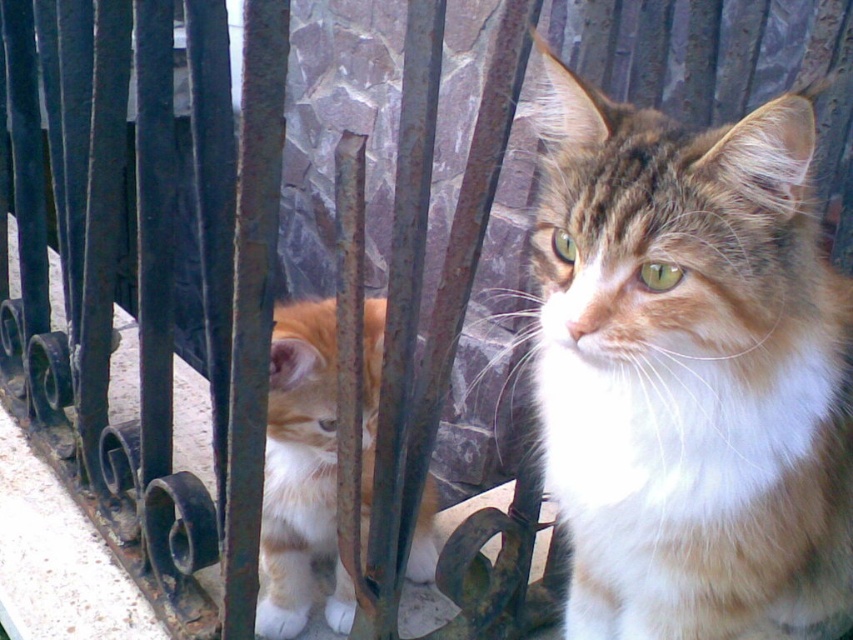
Who is positioned more to the left, fluffy orange-white cat at center or orange tabby fur at left?

orange tabby fur at left is more to the left.

The image size is (853, 640). What do you see at coordinates (689, 371) in the screenshot? I see `fluffy orange-white cat at center` at bounding box center [689, 371].

Where is `fluffy orange-white cat at center`? The height and width of the screenshot is (640, 853). fluffy orange-white cat at center is located at coordinates (689, 371).